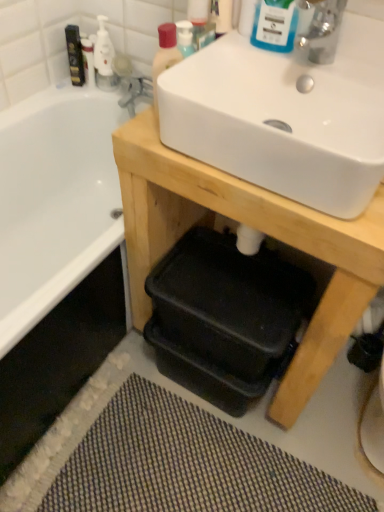
Question: From the image's perspective, is matte plastic bottle at upper center above or below blue glossy bottle at upper center, which is the 2th mouthwash from left to right?

Choices:
 (A) below
 (B) above

Answer: (A)

Question: Based on their sizes in the image, would you say matte plastic bottle at upper center is bigger or smaller than blue glossy bottle at upper center, which is the first mouthwash from bottom to top?

Choices:
 (A) small
 (B) big

Answer: (A)

Question: Which of these objects is positioned closest to the white glossy bottle at upper left?

Choices:
 (A) white glossy sink at upper center
 (B) matte plastic bottle at upper center
 (C) textured gray bath mat at lower center
 (D) matte black mouthwash at upper left, the first mouthwash when ordered from back to front
 (E) wooden table at center

Answer: (D)

Question: Which of these objects is positioned closest to the wooden table at center?

Choices:
 (A) silver metallic faucet at upper right
 (B) white glossy sink at upper center
 (C) blue glossy bottle at upper center, positioned as the 1th mouthwash in right-to-left order
 (D) matte black mouthwash at upper left, which is the 2th mouthwash in right-to-left order
 (E) white glossy bottle at upper left

Answer: (B)